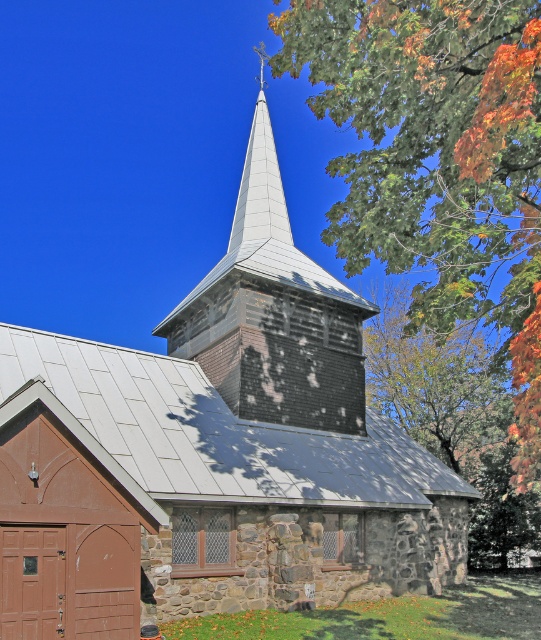
Locate an element on the screen. The width and height of the screenshot is (541, 640). weathered wood steeple at center is located at coordinates (273, 314).

Does weathered wood steeple at center have a lesser width compared to white metallic spire at upper center?

In fact, weathered wood steeple at center might be wider than white metallic spire at upper center.

Who is more forward, (220,388) or (274,193)?

Point (220,388)

Identify the location of weathered wood steeple at center. point(273,314).

Does green leafy tree at upper right have a larger size compared to weathered wood steeple at center?

Correct, green leafy tree at upper right is larger in size than weathered wood steeple at center.

Can you confirm if green leafy tree at upper right is positioned to the left of weathered wood steeple at center?

Incorrect, green leafy tree at upper right is not on the left side of weathered wood steeple at center.

This screenshot has width=541, height=640. Describe the element at coordinates (438, 161) in the screenshot. I see `green leafy tree at upper right` at that location.

This screenshot has width=541, height=640. What are the coordinates of `green leafy tree at upper right` in the screenshot? It's located at (438, 161).

Is the position of green leafy tree at upper right more distant than that of white metallic spire at upper center?

That is False.

Between green leafy tree at upper right and white metallic spire at upper center, which one appears on the left side from the viewer's perspective?

white metallic spire at upper center

Find the location of a particular element. The height and width of the screenshot is (640, 541). green leafy tree at upper right is located at coordinates (438, 161).